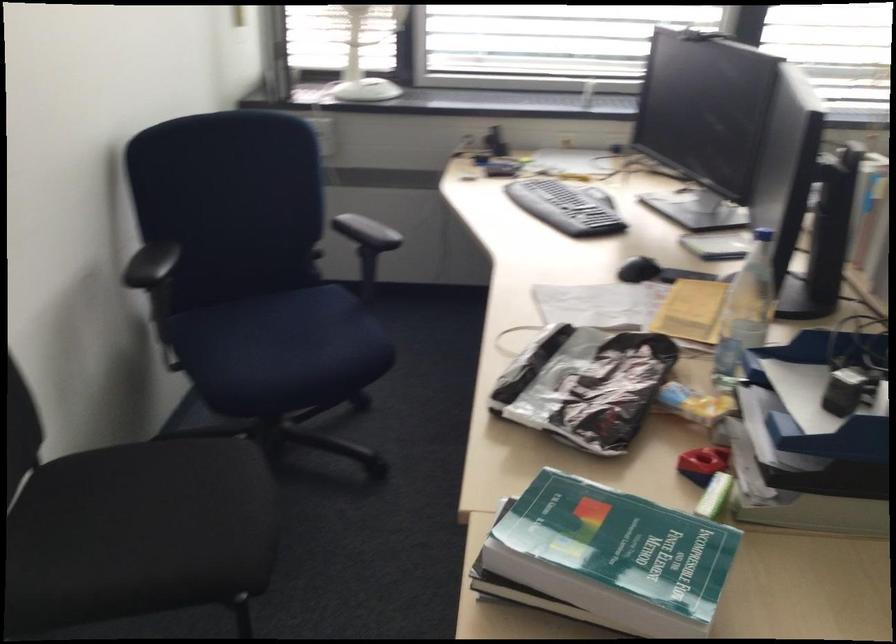
Find where to sit the black chair sitting surface. Please return your answer as a coordinate pair (x, y).

(157, 500)